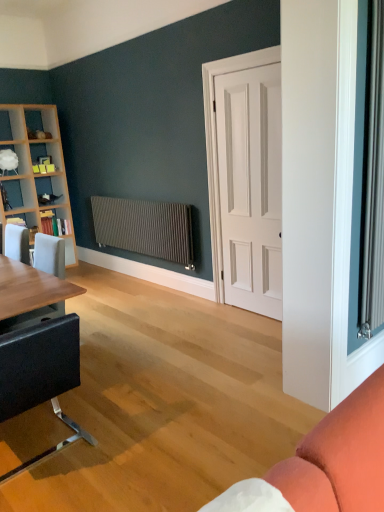
Question: Can you confirm if white glossy shelf at upper left, which is the third shelf in bottom-to-top order, is positioned to the left of wooden bookshelf at left, arranged as the 2th shelf when viewed from the top?

Choices:
 (A) no
 (B) yes

Answer: (B)

Question: Is the surface of white glossy shelf at upper left, which is the third shelf in bottom-to-top order, in direct contact with wooden bookshelf at left, arranged as the 2th shelf when viewed from the top?

Choices:
 (A) yes
 (B) no

Answer: (B)

Question: Is white glossy shelf at upper left, which appears as the 1th shelf when viewed from the top, turned away from wooden bookshelf at left, arranged as the 2th shelf when viewed from the top?

Choices:
 (A) yes
 (B) no

Answer: (B)

Question: Can you confirm if white glossy shelf at upper left, which appears as the 1th shelf when viewed from the top, is positioned to the right of wooden bookshelf at left, arranged as the 2th shelf when viewed from the top?

Choices:
 (A) yes
 (B) no

Answer: (B)

Question: Is white glossy shelf at upper left, which appears as the 1th shelf when viewed from the top, taller than wooden bookshelf at left, which is counted as the second shelf, starting from the bottom?

Choices:
 (A) yes
 (B) no

Answer: (B)

Question: Choose the correct answer: Is matte metallic radiator at center inside white matte door at center or outside it?

Choices:
 (A) outside
 (B) inside

Answer: (A)

Question: Does point (173, 229) appear closer or farther from the camera than point (258, 159)?

Choices:
 (A) farther
 (B) closer

Answer: (A)

Question: In the image, is matte metallic radiator at center on the left side or the right side of white matte door at center?

Choices:
 (A) left
 (B) right

Answer: (A)

Question: In terms of size, does matte metallic radiator at center appear bigger or smaller than white matte door at center?

Choices:
 (A) big
 (B) small

Answer: (B)

Question: Considering the positions of black leather chair at lower left and white glossy shelf at upper left, which appears as the 1th shelf when viewed from the top, in the image, is black leather chair at lower left taller or shorter than white glossy shelf at upper left, which appears as the 1th shelf when viewed from the top,?

Choices:
 (A) short
 (B) tall

Answer: (B)

Question: From a real-world perspective, is black leather chair at lower left above or below white glossy shelf at upper left, which is the third shelf in bottom-to-top order?

Choices:
 (A) above
 (B) below

Answer: (B)

Question: Looking at their shapes, would you say black leather chair at lower left is wider or thinner than white glossy shelf at upper left, which appears as the 1th shelf when viewed from the top?

Choices:
 (A) wide
 (B) thin

Answer: (A)

Question: In the image, is black leather chair at lower left on the left side or the right side of white glossy shelf at upper left, which is the third shelf in bottom-to-top order?

Choices:
 (A) right
 (B) left

Answer: (A)

Question: Is white matte door at center bigger or smaller than wooden bookshelf at left, which is the third shelf in top-to-bottom order?

Choices:
 (A) big
 (B) small

Answer: (A)

Question: Does point (266, 226) appear closer or farther from the camera than point (26, 224)?

Choices:
 (A) closer
 (B) farther

Answer: (A)